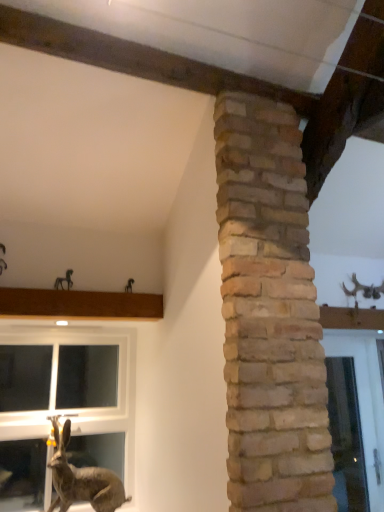
Question: Is metallic horse at upper left taller than clear glass window at lower left?

Choices:
 (A) no
 (B) yes

Answer: (A)

Question: Can you confirm if metallic horse at upper left is positioned to the right of clear glass window at lower left?

Choices:
 (A) no
 (B) yes

Answer: (B)

Question: Considering the relative sizes of metallic horse at upper left and clear glass window at lower left in the image provided, is metallic horse at upper left bigger than clear glass window at lower left?

Choices:
 (A) no
 (B) yes

Answer: (A)

Question: Could you tell me if metallic horse at upper left is facing clear glass window at lower left?

Choices:
 (A) yes
 (B) no

Answer: (B)

Question: From a real-world perspective, is metallic horse at upper left on clear glass window at lower left?

Choices:
 (A) no
 (B) yes

Answer: (B)

Question: Is clear glass window at lower left surrounded by metallic horse at upper left?

Choices:
 (A) yes
 (B) no

Answer: (B)

Question: From the image's perspective, is clear glass window at lower left beneath brown textured rabbit at lower left?

Choices:
 (A) yes
 (B) no

Answer: (B)

Question: Does clear glass window at lower left have a lesser height compared to brown textured rabbit at lower left?

Choices:
 (A) no
 (B) yes

Answer: (A)

Question: Is clear glass window at lower left closer to camera compared to brown textured rabbit at lower left?

Choices:
 (A) no
 (B) yes

Answer: (A)

Question: Considering the relative sizes of clear glass window at lower left and brown textured rabbit at lower left in the image provided, is clear glass window at lower left thinner than brown textured rabbit at lower left?

Choices:
 (A) no
 (B) yes

Answer: (B)

Question: Does clear glass window at lower left appear on the right side of brown textured rabbit at lower left?

Choices:
 (A) no
 (B) yes

Answer: (A)

Question: Is clear glass window at lower left placed right next to brown textured rabbit at lower left?

Choices:
 (A) yes
 (B) no

Answer: (B)

Question: From the image's perspective, is clear glass window at lower left below metallic horse at upper left?

Choices:
 (A) no
 (B) yes

Answer: (B)